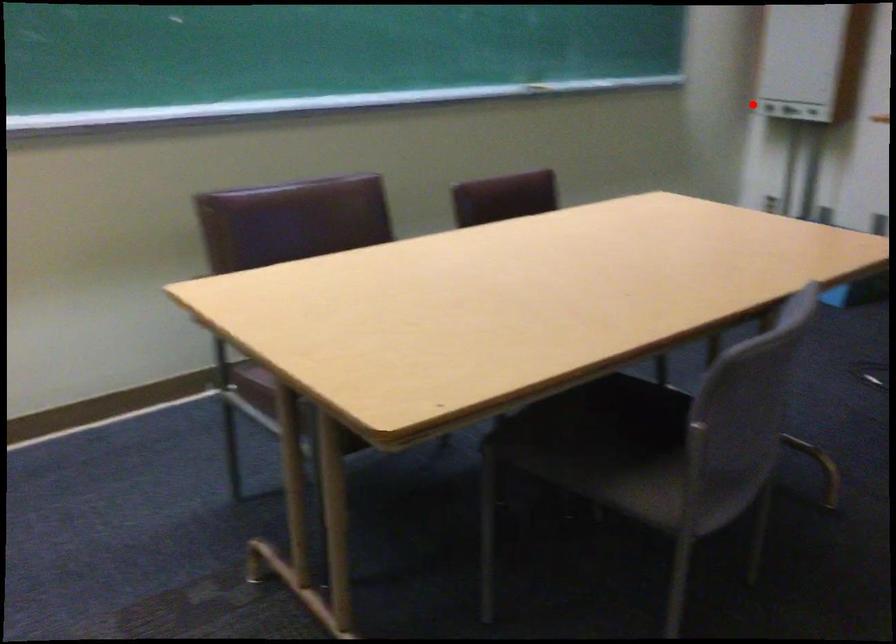
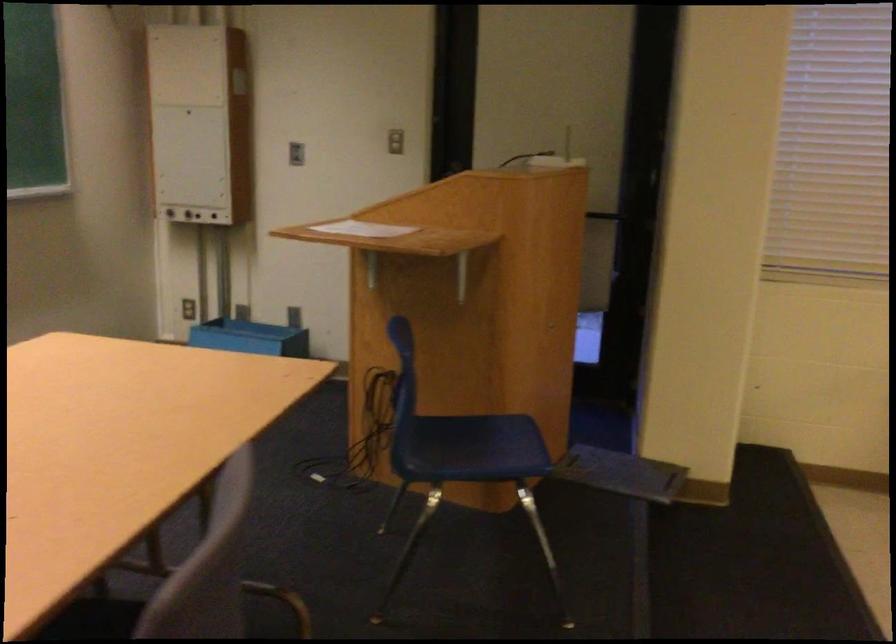
Locate, in the second image, the point that corresponds to the highlighted location in the first image.

(167, 210)